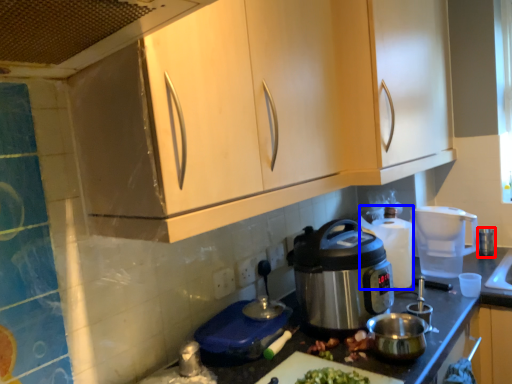
Question: Among these objects, which one is nearest to the camera, appliance (highlighted by a red box) or appliance (highlighted by a blue box)?

Choices:
 (A) appliance
 (B) appliance

Answer: (B)